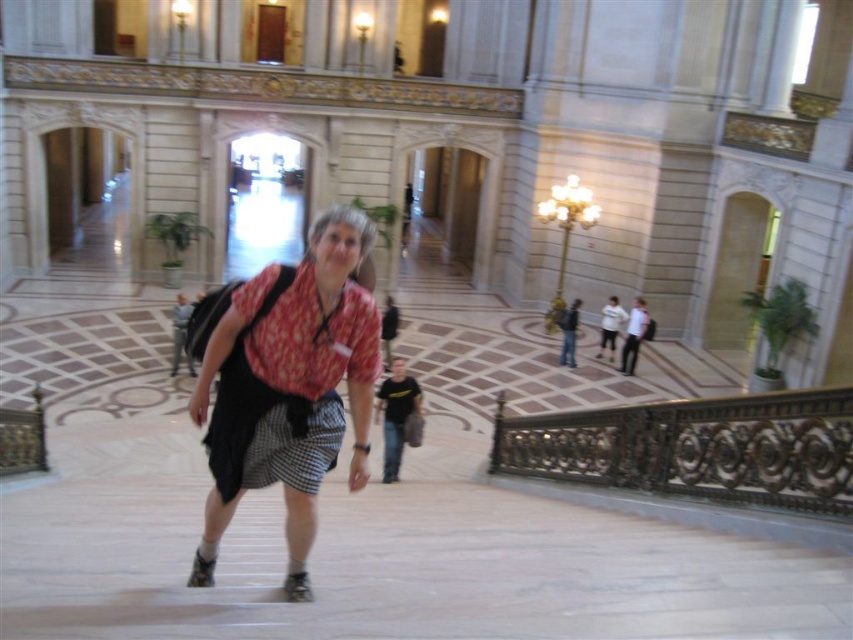
Does matte pink blouse at center lie behind gold ornate railing at lower right?

No.

Between matte pink blouse at center and gold ornate railing at lower right, which one appears on the right side from the viewer's perspective?

gold ornate railing at lower right is more to the right.

Which is behind, point (311, 346) or point (766, 403)?

The point (766, 403) is more distant.

Identify the location of matte pink blouse at center. The height and width of the screenshot is (640, 853). (289, 387).